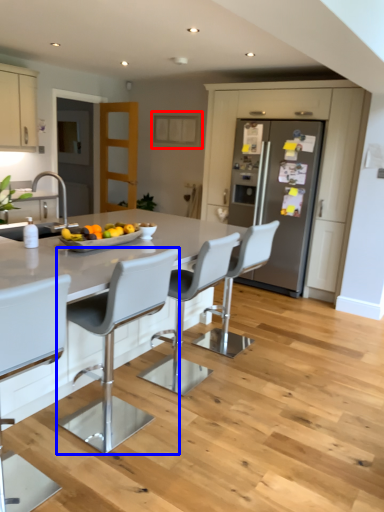
Question: Which point is closer to the camera, cabinetry (highlighted by a red box) or chair (highlighted by a blue box)?

Choices:
 (A) cabinetry
 (B) chair

Answer: (B)